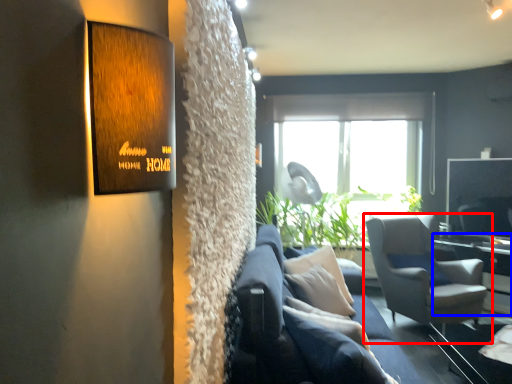
Question: Which object appears closest to the camera in this image, chair (highlighted by a red box) or table (highlighted by a blue box)?

Choices:
 (A) chair
 (B) table

Answer: (A)